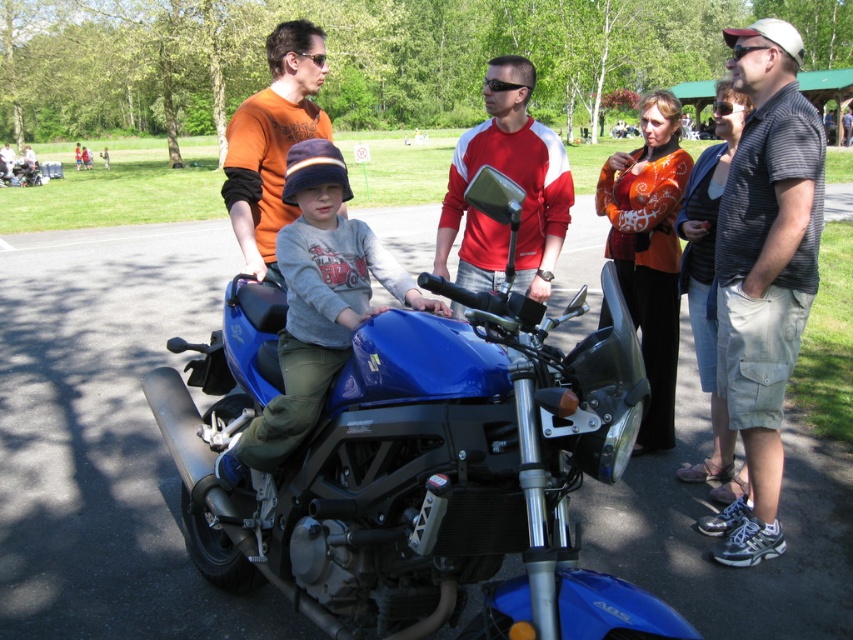
Is point (444, 516) positioned in front of point (271, 42)?

Yes, point (444, 516) is in front of point (271, 42).

Which is more to the right, blue matte motorcycle at center or orange t-shirt at upper center?

From the viewer's perspective, blue matte motorcycle at center appears more on the right side.

Is point (367, 355) positioned after point (256, 211)?

That is False.

The image size is (853, 640). I want to click on blue matte motorcycle at center, so tap(418, 468).

Can you confirm if matte blue motorcycle at center is positioned below red/white jersey at center?

Yes.

At what (x,y) coordinates should I click in order to perform the action: click on matte blue motorcycle at center. Please return your answer as a coordinate pair (x, y). The height and width of the screenshot is (640, 853). Looking at the image, I should click on (316, 305).

Is striped cotton shirt at right thinner than matte blue motorcycle at center?

Indeed, striped cotton shirt at right has a lesser width compared to matte blue motorcycle at center.

Consider the image. Is striped cotton shirt at right below matte blue motorcycle at center?

No.

Identify the location of striped cotton shirt at right. This screenshot has height=640, width=853. (764, 273).